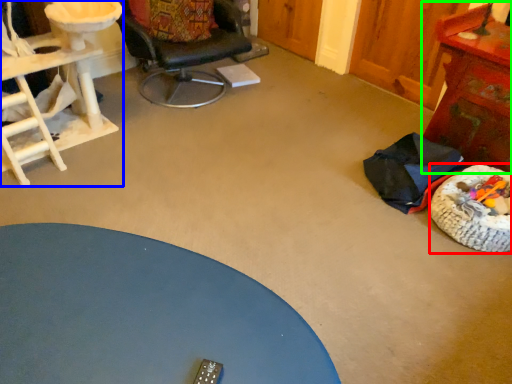
Question: Considering the real-world distances, which object is farthest from dog bed (highlighted by a red box)? desk (highlighted by a blue box) or table (highlighted by a green box)?

Choices:
 (A) desk
 (B) table

Answer: (A)